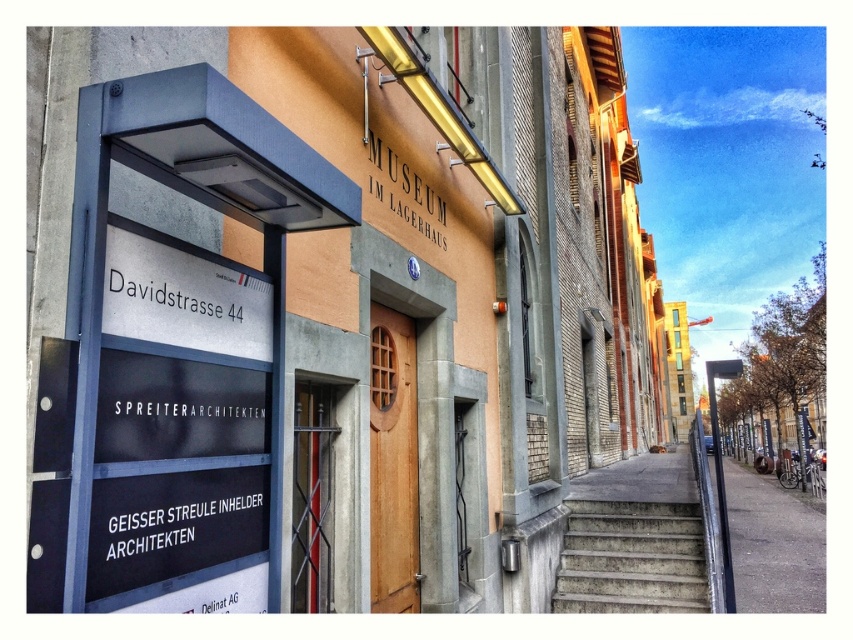
You are standing at the entrance of the Museum im Lagerhaus. You want to reach a specific point marked at coordinates point (242, 289). If you move directly towards it from your current position, how far will you have to walk?

The point (242, 289) is 2.14 meters away from the viewer, so you will have to walk 2.14 meters to reach it.

You are standing in front of the Museum im Lagerhaus and want to read the address displayed on the black plastic sign at left and the metallic pole at right. Which object is positioned higher relative to the other?

The black plastic sign at left is above the metallic pole at right, so the black plastic sign at left is positioned higher than the metallic pole at right.